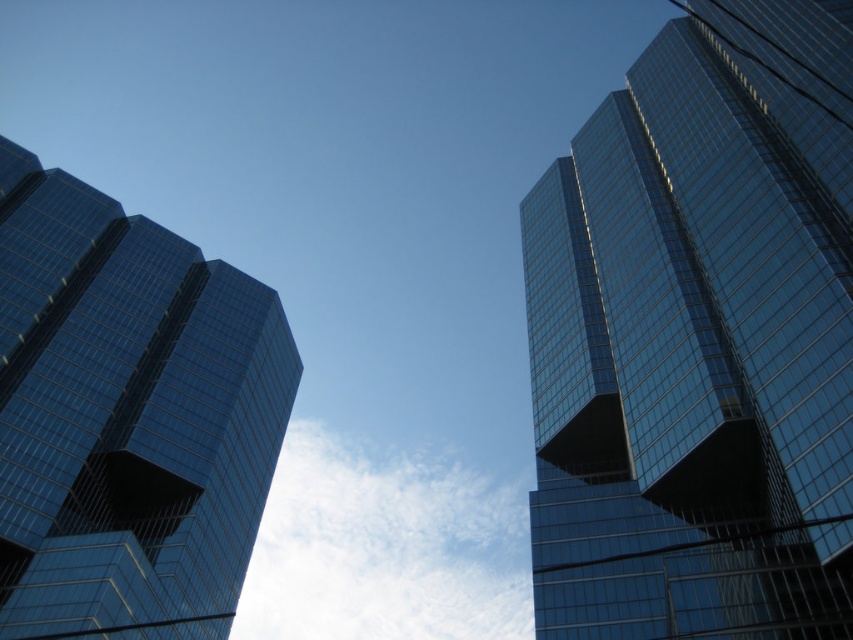
You are standing at the base of the two skyscrapers and notice a point marked at coordinates (699,339). Which skyscraper does this point belong to?

The point marked at coordinates (699,339) belongs to the glossy glass skyscraper at upper right.

You are standing at the base of the left skyscraper and want to reach a point marked at coordinates point (614, 468). Given that the distance between you and this point is 78.25 meters, can you estimate how far you need to walk horizontally to reach it?

The point (614, 468) is 78.25 meters away from you, so you need to walk approximately 78.25 meters horizontally to reach it.

You are standing at the center of the image and looking upwards. Which direction should you turn to face the glossy glass skyscraper at upper right?

Since the glossy glass skyscraper at upper right is located at point 0.530 on the x axis and 0.821 on the y axis, you should turn to your right to face it.